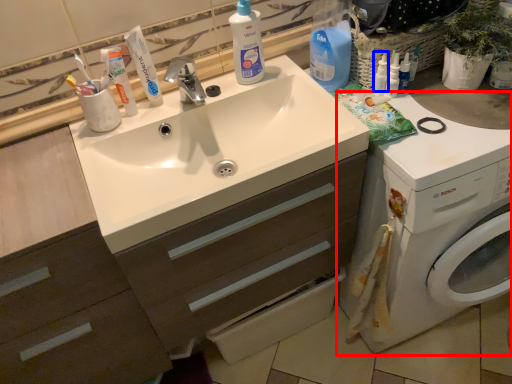
Question: Among these objects, which one is farthest to the camera, washing machine (highlighted by a red box) or cleaning product (highlighted by a blue box)?

Choices:
 (A) washing machine
 (B) cleaning product

Answer: (B)